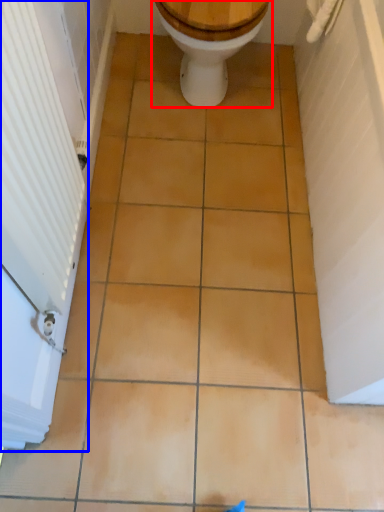
Question: Which point is closer to the camera, toilet (highlighted by a red box) or screen door (highlighted by a blue box)?

Choices:
 (A) toilet
 (B) screen door

Answer: (B)